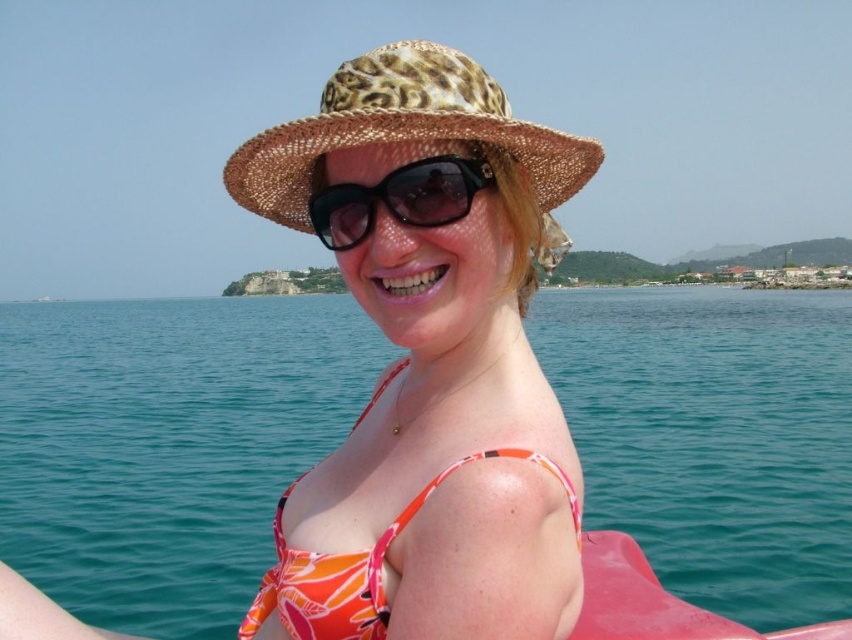
You are standing at the edge of the beach and see both the leopard print hat at center and the leopard print straw hat at center. Which one is closer to you?

The leopard print hat at center is closer to you because it is only 2.38 meters away from the leopard print straw hat at center, but since they are two different hats, their positions might vary. However, according to the description, the distance between them is 2.38 meters, so without additional information about their exact positions relative to your location, it is impossible to determine which is closer.

You are a photographer trying to capture the perfect shot of the leopard print hat at center. The camera you are using has a focus point at coordinate point (429, 358). Will the leopard print hat at center be in focus?

The leopard print hat at center is located at point (429, 358), so yes, the leopard print hat at center will be in focus since the camera focus point is exactly at that coordinate.

You are a photographer trying to capture the perfect shot of the leopard print hat at center and the leopard print straw hat at center. Which one is closer to the camera?

The leopard print hat at center is closer to the camera because it is in front of the leopard print straw hat at center.